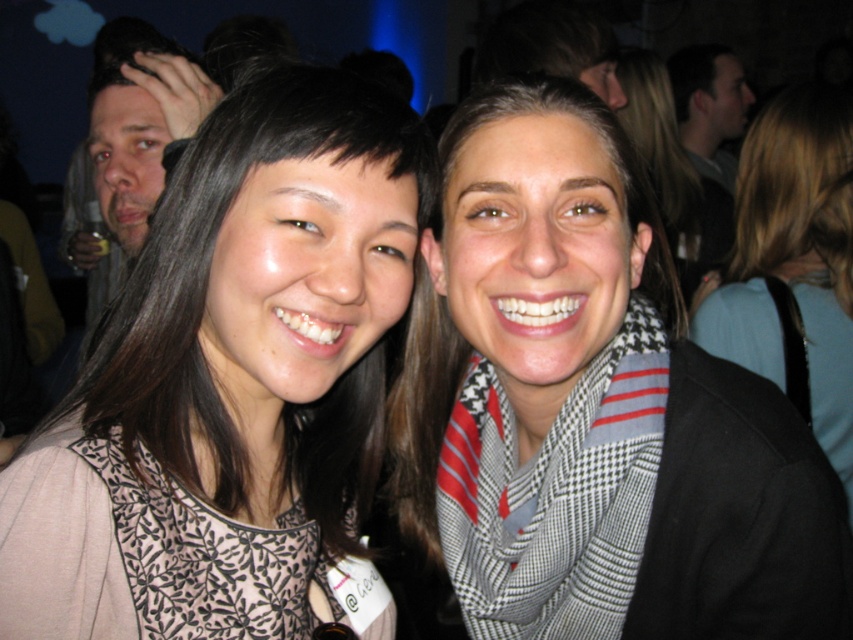
You are at a social event and want to take a photo with the two people in the scene. The photographer tells you to stand to the right of the white and black checkered scarf at center and to the left of the dark hair at upper right. Can you fit between them?

The white and black checkered scarf at center is positioned on the left side of dark hair at upper right, so yes, you can fit between them by standing to the right of the scarf and to the left of the dark hair.

You are at a social gathering and see two people posing for a photo. The person on the left has a name tag labeled with the username of the person on the left. The person on the right is wearing a black jacket over a checkered scarf with red stripes. There is a point at coordinates point (596, 397). Which object from the following list is this point located on? The options are the white and black checkered scarf at center or the black floral pattern top at left.

The point (596, 397) is located on the white and black checkered scarf at center.